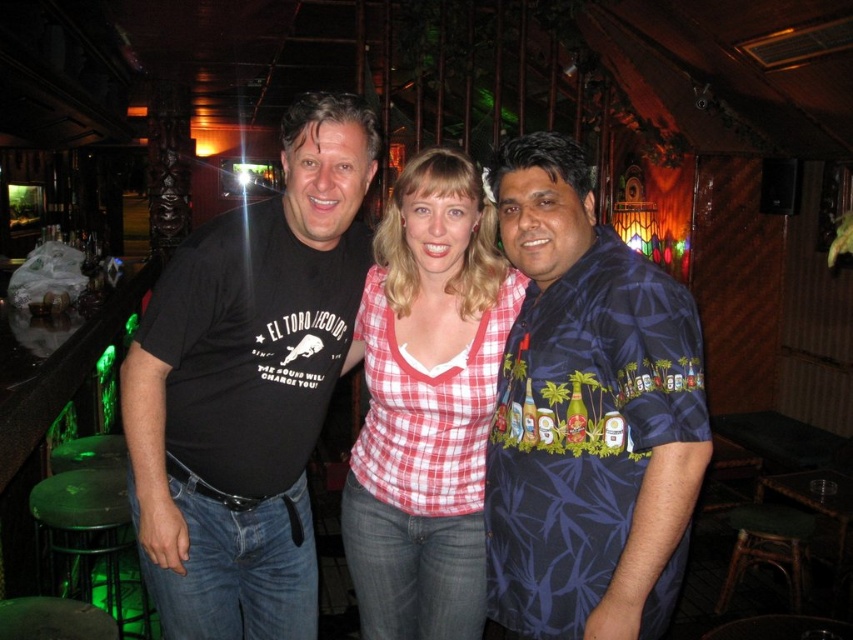
You are a photographer setting up for a group photo at a bar. You need to ensure that all subjects fit within the frame. The red checkered shirt at center and the rattan stool at lower right are in your shot. Which object is wider and might require adjusting the camera angle to include both?

The red checkered shirt at center is wider than the rattan stool at lower right, so adjusting the camera angle to accommodate its width would be necessary to include both in the frame.

You are a photographer standing at the entrance of the bar. You want to take a photo of the red checkered shirt at center and the rattan stool at lower right. Which object is closer to the camera?

The red checkered shirt at center is closer to the camera because it is in front of the rattan stool at lower right.